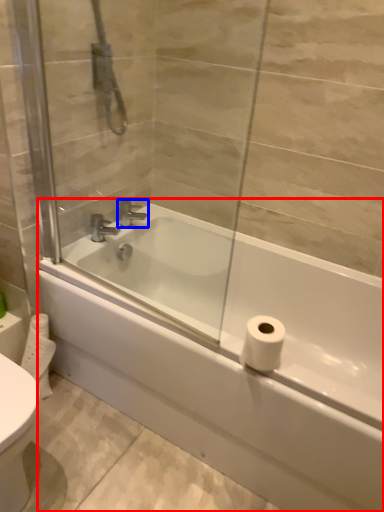
Question: Which point is further to the camera, bathtub (highlighted by a red box) or tap (highlighted by a blue box)?

Choices:
 (A) bathtub
 (B) tap

Answer: (B)